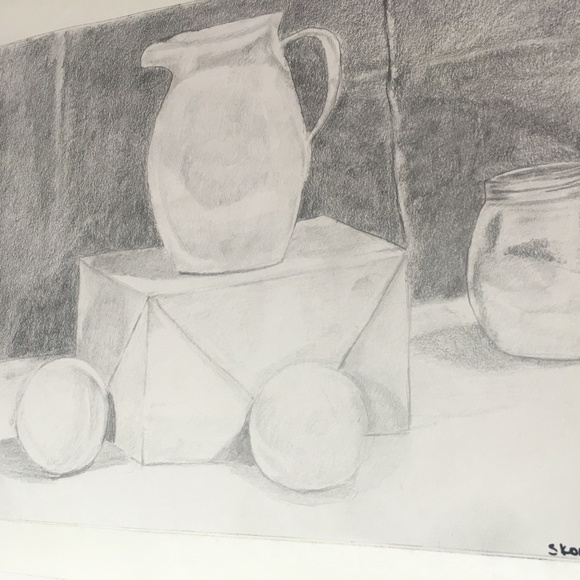
This screenshot has height=580, width=580. In order to click on box in this screenshot , I will do `click(148, 406)`.